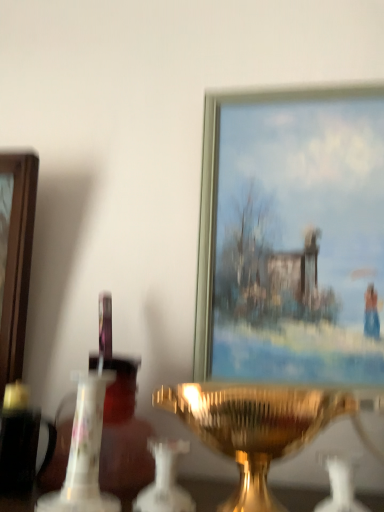
Find the location of a particular element. The width and height of the screenshot is (384, 512). white porcelain candle holder at center, acting as the 1th candle holder starting from the left is located at coordinates (84, 453).

Where is `gold metallic candle holder at center, the 2th candle holder when ordered from right to left`? gold metallic candle holder at center, the 2th candle holder when ordered from right to left is located at coordinates (254, 428).

Considering the sizes of metallic gold picture frame at upper center and white glass candle holder at center, the third candle holder in the left-to-right sequence, in the image, is metallic gold picture frame at upper center wider or thinner than white glass candle holder at center, the third candle holder in the left-to-right sequence,?

Considering their sizes, metallic gold picture frame at upper center looks slimmer than white glass candle holder at center, the third candle holder in the left-to-right sequence.

Which is correct: metallic gold picture frame at upper center is inside white glass candle holder at center, the first candle holder when ordered from right to left, or outside of it?

metallic gold picture frame at upper center is located beyond the bounds of white glass candle holder at center, the first candle holder when ordered from right to left.

From the picture: From the image's perspective, would you say metallic gold picture frame at upper center is positioned over white glass candle holder at center, the third candle holder in the left-to-right sequence?

Yes.

Is white porcelain candle holder at center, which is the third candle holder in right-to-left order, oriented towards metallic gold picture frame at upper center?

No, white porcelain candle holder at center, which is the third candle holder in right-to-left order, is not facing towards metallic gold picture frame at upper center.

Is white porcelain candle holder at center, acting as the 1th candle holder starting from the left, smaller than metallic gold picture frame at upper center?

Yes, white porcelain candle holder at center, acting as the 1th candle holder starting from the left, is smaller than metallic gold picture frame at upper center.

Is point (95, 462) behind point (247, 334)?

No, it is in front of (247, 334).

Is white porcelain candle holder at center, which is the third candle holder in right-to-left order, far away from metallic gold picture frame at upper center?

No, white porcelain candle holder at center, which is the third candle holder in right-to-left order, is not far away from metallic gold picture frame at upper center.

Which is in front, white porcelain candle holder at center, which is the third candle holder in right-to-left order, or gold metallic candle holder at center, the 2th candle holder when ordered from right to left?

Positioned in front is gold metallic candle holder at center, the 2th candle holder when ordered from right to left.

Is white porcelain candle holder at center, acting as the 1th candle holder starting from the left, next to gold metallic candle holder at center, the second candle holder in the left-to-right sequence?

white porcelain candle holder at center, acting as the 1th candle holder starting from the left, is not next to gold metallic candle holder at center, the second candle holder in the left-to-right sequence, and they're not touching.

From the image's perspective, which is below, white porcelain candle holder at center, acting as the 1th candle holder starting from the left, or white glass candle holder at center, the first candle holder when ordered from right to left?

From the image's view, white glass candle holder at center, the first candle holder when ordered from right to left, is below.

Based on the photo, from a real-world perspective, is white porcelain candle holder at center, acting as the 1th candle holder starting from the left, positioned under white glass candle holder at center, the third candle holder in the left-to-right sequence, based on gravity?

No, from a real-world perspective, white porcelain candle holder at center, acting as the 1th candle holder starting from the left, is not below white glass candle holder at center, the third candle holder in the left-to-right sequence.

Considering the relative sizes of white porcelain candle holder at center, acting as the 1th candle holder starting from the left, and white glass candle holder at center, the third candle holder in the left-to-right sequence, in the image provided, is white porcelain candle holder at center, acting as the 1th candle holder starting from the left, smaller than white glass candle holder at center, the third candle holder in the left-to-right sequence,?

No, white porcelain candle holder at center, acting as the 1th candle holder starting from the left, is not smaller than white glass candle holder at center, the third candle holder in the left-to-right sequence.

Between point (47, 500) and point (343, 453), which one is positioned in front?

The point (47, 500) is closer to the camera.

From a real-world perspective, is gold metallic candle holder at center, the 2th candle holder when ordered from right to left, positioned above or below metallic gold picture frame at upper center?

gold metallic candle holder at center, the 2th candle holder when ordered from right to left, is below metallic gold picture frame at upper center.

Is gold metallic candle holder at center, the 2th candle holder when ordered from right to left, positioned with its back to metallic gold picture frame at upper center?

That's not correct — gold metallic candle holder at center, the 2th candle holder when ordered from right to left, is not looking away from metallic gold picture frame at upper center.

Are gold metallic candle holder at center, the 2th candle holder when ordered from right to left, and metallic gold picture frame at upper center far apart?

No, gold metallic candle holder at center, the 2th candle holder when ordered from right to left, is in close proximity to metallic gold picture frame at upper center.

Which of these two, gold metallic candle holder at center, the second candle holder in the left-to-right sequence, or metallic gold picture frame at upper center, is wider?

Wider between the two is gold metallic candle holder at center, the second candle holder in the left-to-right sequence.

The image size is (384, 512). Identify the location of candle holder behind the white glass candle holder at center, the first candle holder when ordered from right to left. (84, 453).

From the image's perspective, is white glass candle holder at center, the third candle holder in the left-to-right sequence, below white porcelain candle holder at center, acting as the 1th candle holder starting from the left?

Correct, white glass candle holder at center, the third candle holder in the left-to-right sequence, appears lower than white porcelain candle holder at center, acting as the 1th candle holder starting from the left, in the image.

Can you confirm if white glass candle holder at center, the third candle holder in the left-to-right sequence, is wider than white porcelain candle holder at center, which is the third candle holder in right-to-left order?

Incorrect, the width of white glass candle holder at center, the third candle holder in the left-to-right sequence, does not surpass that of white porcelain candle holder at center, which is the third candle holder in right-to-left order.

Can you tell me how much white glass candle holder at center, the first candle holder when ordered from right to left, and white porcelain candle holder at center, acting as the 1th candle holder starting from the left, differ in facing direction?

The angular difference between white glass candle holder at center, the first candle holder when ordered from right to left, and white porcelain candle holder at center, acting as the 1th candle holder starting from the left, is 0.45 degrees.

From the image's perspective, is metallic gold picture frame at upper center positioned above or below gold metallic candle holder at center, the 2th candle holder when ordered from right to left?

From the image's perspective, metallic gold picture frame at upper center appears above gold metallic candle holder at center, the 2th candle holder when ordered from right to left.

From a real-world perspective, who is located lower, metallic gold picture frame at upper center or gold metallic candle holder at center, the second candle holder in the left-to-right sequence?

gold metallic candle holder at center, the second candle holder in the left-to-right sequence, is physically lower.

Could gold metallic candle holder at center, the 2th candle holder when ordered from right to left, be considered to be inside metallic gold picture frame at upper center?

Definitely not — gold metallic candle holder at center, the 2th candle holder when ordered from right to left, is not inside metallic gold picture frame at upper center.

Considering the relative sizes of metallic gold picture frame at upper center and gold metallic candle holder at center, the 2th candle holder when ordered from right to left, in the image provided, is metallic gold picture frame at upper center bigger than gold metallic candle holder at center, the 2th candle holder when ordered from right to left,?

Correct, metallic gold picture frame at upper center is larger in size than gold metallic candle holder at center, the 2th candle holder when ordered from right to left.

In order to click on candle holder that is the 2nd one when counting forward from the metallic gold picture frame at upper center in this screenshot , I will do `click(339, 483)`.

Image resolution: width=384 pixels, height=512 pixels. I want to click on picture frame behind the white porcelain candle holder at center, which is the third candle holder in right-to-left order, so click(x=291, y=237).

When comparing their distances from metallic gold picture frame at upper center, does white glass candle holder at center, the first candle holder when ordered from right to left, or white porcelain candle holder at center, acting as the 1th candle holder starting from the left, seem further?

white porcelain candle holder at center, acting as the 1th candle holder starting from the left, is further to metallic gold picture frame at upper center.

Which object lies further to the anchor point gold metallic candle holder at center, the 2th candle holder when ordered from right to left, white porcelain candle holder at center, which is the third candle holder in right-to-left order, or metallic gold picture frame at upper center?

The object further to gold metallic candle holder at center, the 2th candle holder when ordered from right to left, is metallic gold picture frame at upper center.

Considering their positions, is white glass candle holder at center, the third candle holder in the left-to-right sequence, positioned further to white porcelain candle holder at center, which is the third candle holder in right-to-left order, than metallic gold picture frame at upper center?

metallic gold picture frame at upper center lies further to white porcelain candle holder at center, which is the third candle holder in right-to-left order, than the other object.

Which object lies further to the anchor point gold metallic candle holder at center, the second candle holder in the left-to-right sequence, white glass candle holder at center, the first candle holder when ordered from right to left, or white porcelain candle holder at center, which is the third candle holder in right-to-left order?

white porcelain candle holder at center, which is the third candle holder in right-to-left order, is further to gold metallic candle holder at center, the second candle holder in the left-to-right sequence.

In the scene shown: Considering their positions, is white glass candle holder at center, the third candle holder in the left-to-right sequence, positioned further to metallic gold picture frame at upper center than gold metallic candle holder at center, the 2th candle holder when ordered from right to left?

white glass candle holder at center, the third candle holder in the left-to-right sequence, is further to metallic gold picture frame at upper center.

Looking at the image, which one is located closer to gold metallic candle holder at center, the second candle holder in the left-to-right sequence, metallic gold picture frame at upper center or white porcelain candle holder at center, acting as the 1th candle holder starting from the left?

white porcelain candle holder at center, acting as the 1th candle holder starting from the left, is positioned closer to the anchor gold metallic candle holder at center, the second candle holder in the left-to-right sequence.

Considering their positions, is gold metallic candle holder at center, the second candle holder in the left-to-right sequence, positioned further to white porcelain candle holder at center, which is the third candle holder in right-to-left order, than white glass candle holder at center, the first candle holder when ordered from right to left?

The object further to white porcelain candle holder at center, which is the third candle holder in right-to-left order, is white glass candle holder at center, the first candle holder when ordered from right to left.

Which object lies nearer to the anchor point gold metallic candle holder at center, the 2th candle holder when ordered from right to left, metallic gold picture frame at upper center or white glass candle holder at center, the third candle holder in the left-to-right sequence?

white glass candle holder at center, the third candle holder in the left-to-right sequence, is closer to gold metallic candle holder at center, the 2th candle holder when ordered from right to left.

In order to click on candle holder located between white porcelain candle holder at center, acting as the 1th candle holder starting from the left, and white glass candle holder at center, the first candle holder when ordered from right to left, in the left-right direction in this screenshot , I will do [x=254, y=428].

The width and height of the screenshot is (384, 512). Identify the location of candle holder between metallic gold picture frame at upper center and gold metallic candle holder at center, the second candle holder in the left-to-right sequence, in the up-down direction. (84, 453).